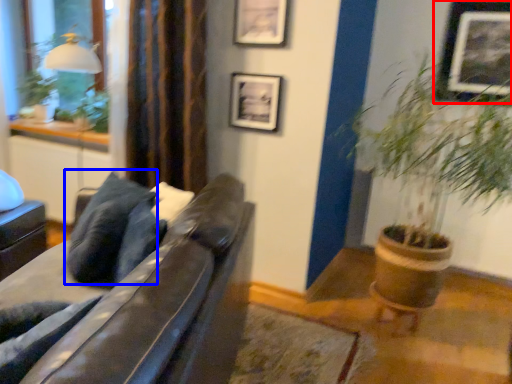
Question: Which of the following is the farthest to the observer, picture frame (highlighted by a red box) or pillow (highlighted by a blue box)?

Choices:
 (A) picture frame
 (B) pillow

Answer: (A)